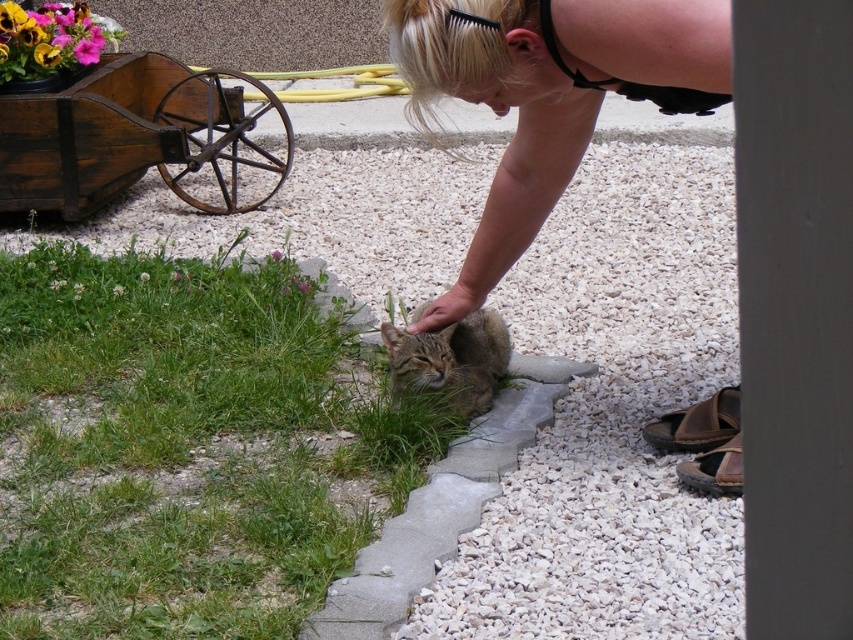
Question: Can you confirm if green grass at lower left is positioned to the left of tabby fur cat at center?

Choices:
 (A) no
 (B) yes

Answer: (B)

Question: Estimate the real-world distances between objects in this image. Which object is closer to the tabby fur cat at center?

Choices:
 (A) green grass at lower left
 (B) blonde hair at upper center

Answer: (B)

Question: Does green grass at lower left appear over blonde hair at upper center?

Choices:
 (A) yes
 (B) no

Answer: (B)

Question: Which of the following is the closest to the observer?

Choices:
 (A) (392, 396)
 (B) (82, 602)
 (C) (432, 321)

Answer: (B)

Question: Which object is farther from the camera taking this photo?

Choices:
 (A) tabby fur cat at center
 (B) green grass at lower left
 (C) blonde hair at upper center

Answer: (A)

Question: Is green grass at lower left positioned behind tabby fur cat at center?

Choices:
 (A) no
 (B) yes

Answer: (A)